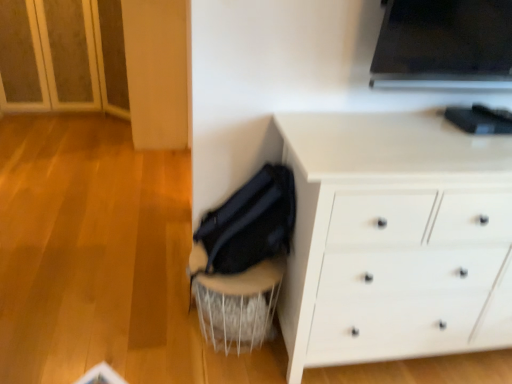
What do you see at coordinates (243, 261) in the screenshot? I see `velvet black swivel chair at lower center` at bounding box center [243, 261].

In order to click on velvet black swivel chair at lower center in this screenshot , I will do `click(243, 261)`.

Find the location of a particular element. Image resolution: width=512 pixels, height=384 pixels. white matte chest of drawers at lower right is located at coordinates (395, 239).

What do you see at coordinates (395, 239) in the screenshot?
I see `white matte chest of drawers at lower right` at bounding box center [395, 239].

Identify the location of velvet black swivel chair at lower center. This screenshot has width=512, height=384. (243, 261).

Which object is positioned more to the left, velvet black swivel chair at lower center or white matte chest of drawers at lower right?

Positioned to the left is velvet black swivel chair at lower center.

Which object is more forward, velvet black swivel chair at lower center or white matte chest of drawers at lower right?

white matte chest of drawers at lower right is more forward.

Which point is more forward, (248, 240) or (460, 325)?

The point (248, 240) is more forward.

From the image's perspective, which object appears higher, velvet black swivel chair at lower center or white matte chest of drawers at lower right?

white matte chest of drawers at lower right, from the image's perspective.

From a real-world perspective, is velvet black swivel chair at lower center located higher than white matte chest of drawers at lower right?

No.

Considering the sizes of objects velvet black swivel chair at lower center and white matte chest of drawers at lower right in the image provided, who is wider, velvet black swivel chair at lower center or white matte chest of drawers at lower right?

With larger width is white matte chest of drawers at lower right.

Which of these two, velvet black swivel chair at lower center or white matte chest of drawers at lower right, stands taller?

white matte chest of drawers at lower right.

In terms of size, does velvet black swivel chair at lower center appear bigger or smaller than white matte chest of drawers at lower right?

In the image, velvet black swivel chair at lower center appears to be smaller than white matte chest of drawers at lower right.

Is velvet black swivel chair at lower center not within white matte chest of drawers at lower right?

velvet black swivel chair at lower center lies outside white matte chest of drawers at lower right's area.

Is velvet black swivel chair at lower center not close to white matte chest of drawers at lower right?

velvet black swivel chair at lower center is near white matte chest of drawers at lower right, not far away.

Does velvet black swivel chair at lower center turn towards white matte chest of drawers at lower right?

No, velvet black swivel chair at lower center is not facing towards white matte chest of drawers at lower right.

Find the location of a particular element. Image resolution: width=512 pixels, height=384 pixels. swivel chair below the white matte chest of drawers at lower right (from a real-world perspective) is located at coordinates (243, 261).

Considering the relative positions of white matte chest of drawers at lower right and velvet black swivel chair at lower center in the image provided, is white matte chest of drawers at lower right to the left of velvet black swivel chair at lower center from the viewer's perspective?

No.

Relative to velvet black swivel chair at lower center, is white matte chest of drawers at lower right in front or behind?

white matte chest of drawers at lower right is positioned closer to the viewer than velvet black swivel chair at lower center.

Is point (487, 337) behind point (260, 335)?

No, it is not.

From the image's perspective, is white matte chest of drawers at lower right above or below velvet black swivel chair at lower center?

Based on their image positions, white matte chest of drawers at lower right is located above velvet black swivel chair at lower center.

From a real-world perspective, which is physically below, white matte chest of drawers at lower right or velvet black swivel chair at lower center?

velvet black swivel chair at lower center, from a real-world perspective.

Considering the sizes of white matte chest of drawers at lower right and velvet black swivel chair at lower center in the image, is white matte chest of drawers at lower right wider or thinner than velvet black swivel chair at lower center?

Clearly, white matte chest of drawers at lower right has more width compared to velvet black swivel chair at lower center.

Is white matte chest of drawers at lower right taller or shorter than velvet black swivel chair at lower center?

white matte chest of drawers at lower right is taller than velvet black swivel chair at lower center.

Is white matte chest of drawers at lower right bigger or smaller than velvet black swivel chair at lower center?

In the image, white matte chest of drawers at lower right appears to be larger than velvet black swivel chair at lower center.

Can velvet black swivel chair at lower center be found inside white matte chest of drawers at lower right?

That's incorrect, velvet black swivel chair at lower center is not inside white matte chest of drawers at lower right.

Is white matte chest of drawers at lower right in contact with velvet black swivel chair at lower center?

There is a gap between white matte chest of drawers at lower right and velvet black swivel chair at lower center.

Could you tell me if white matte chest of drawers at lower right is facing velvet black swivel chair at lower center?

No, white matte chest of drawers at lower right does not turn towards velvet black swivel chair at lower center.

How distant is white matte chest of drawers at lower right from velvet black swivel chair at lower center?

white matte chest of drawers at lower right is 14.86 inches away from velvet black swivel chair at lower center.

Where is `swivel chair below the white matte chest of drawers at lower right (from the image's perspective)`? The height and width of the screenshot is (384, 512). swivel chair below the white matte chest of drawers at lower right (from the image's perspective) is located at coordinates (243, 261).

The image size is (512, 384). I want to click on chest of drawers in front of the velvet black swivel chair at lower center, so click(x=395, y=239).

You are a GUI agent. You are given a task and a screenshot of the screen. Output one action in this format:
    pyautogui.click(x=<x>, y=<y>)
    Task: Click on the chest of drawers located above the velvet black swivel chair at lower center (from a real-world perspective)
    
    Given the screenshot: What is the action you would take?
    pyautogui.click(x=395, y=239)